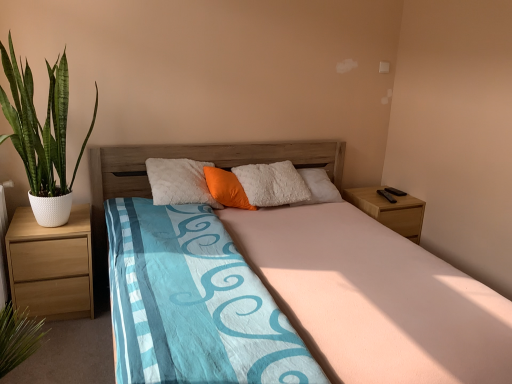
Question: In the image, is wooden bed at center positioned in front of or behind light brown wood at left, which is counted as the 1th nightstand, starting from the front?

Choices:
 (A) behind
 (B) front

Answer: (B)

Question: From a real-world perspective, is wooden bed at center physically located above or below light brown wood at left, which is counted as the 1th nightstand, starting from the front?

Choices:
 (A) below
 (B) above

Answer: (B)

Question: Which is farther from the green leafy plant in textured pot at left?

Choices:
 (A) light brown wood at left, which is the second nightstand in right-to-left order
 (B) wooden nightstand at right, arranged as the second nightstand when viewed from the front
 (C) wooden bed at center
 (D) orange fabric pillow at center

Answer: (B)

Question: Estimate the real-world distances between objects in this image. Which object is farther from the light brown wood at left, which is the second nightstand in right-to-left order?

Choices:
 (A) wooden bed at center
 (B) green leafy plant in textured pot at left
 (C) orange fabric pillow at center
 (D) wooden nightstand at right, which is the 1th nightstand in right-to-left order

Answer: (D)